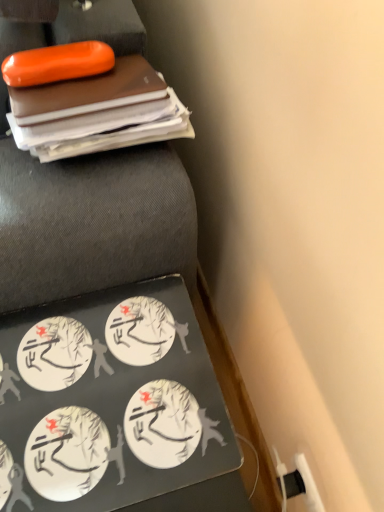
Question: From a real-world perspective, is white matte stickers at bottom left above or below black matte laptop at lower left?

Choices:
 (A) above
 (B) below

Answer: (B)

Question: Based on their sizes in the image, would you say white matte stickers at bottom left is bigger or smaller than black matte laptop at lower left?

Choices:
 (A) big
 (B) small

Answer: (B)

Question: From their relative heights in the image, would you say white matte stickers at bottom left is taller or shorter than black matte laptop at lower left?

Choices:
 (A) tall
 (B) short

Answer: (B)

Question: From a real-world perspective, is black matte laptop at lower left positioned above or below white matte stickers at bottom left?

Choices:
 (A) below
 (B) above

Answer: (B)

Question: Is black matte laptop at lower left situated inside white matte stickers at bottom left or outside?

Choices:
 (A) outside
 (B) inside

Answer: (A)

Question: Looking at their shapes, would you say black matte laptop at lower left is wider or thinner than white matte stickers at bottom left?

Choices:
 (A) wide
 (B) thin

Answer: (A)

Question: Is point (134, 226) positioned closer to the camera than point (19, 481)?

Choices:
 (A) farther
 (B) closer

Answer: (A)